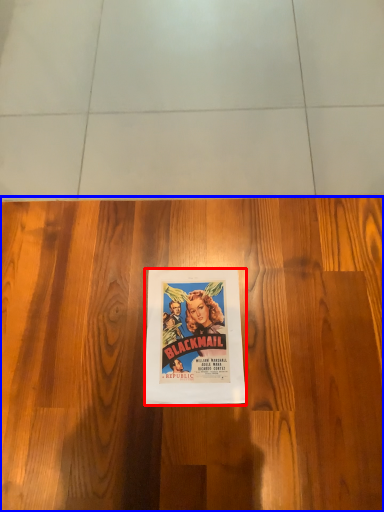
Question: Which object appears farthest to the camera in this image, poster (highlighted by a red box) or hardwood (highlighted by a blue box)?

Choices:
 (A) poster
 (B) hardwood

Answer: (A)